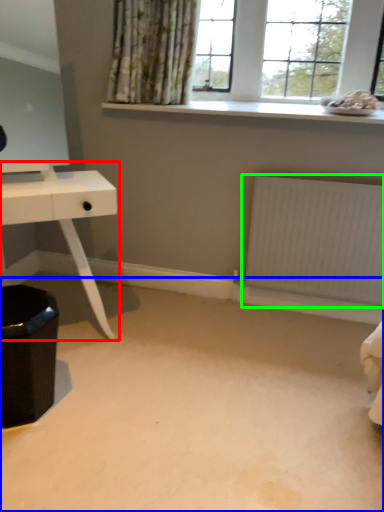
Question: Estimate the real-world distances between objects in this image. Which object is closer to table (highlighted by a red box), plain (highlighted by a blue box) or radiator (highlighted by a green box)?

Choices:
 (A) plain
 (B) radiator

Answer: (A)